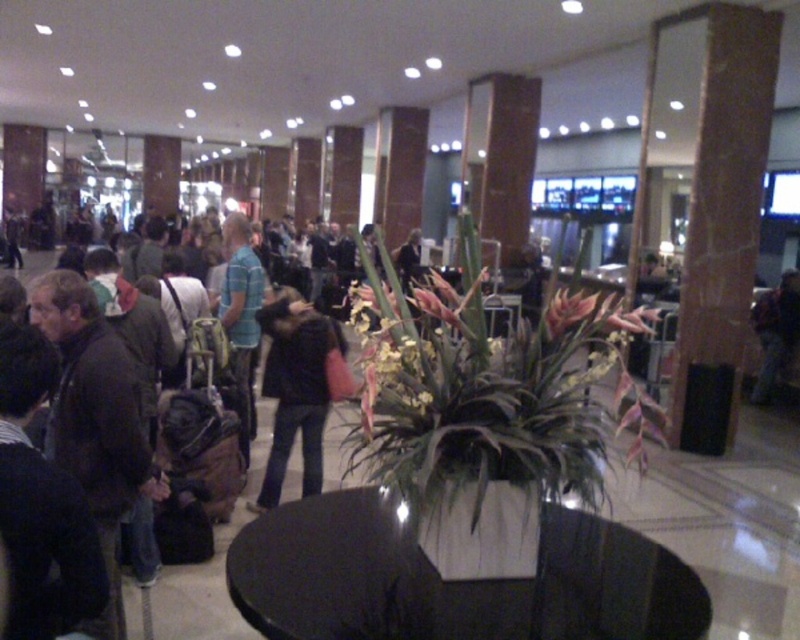
Between black leather jacket at center and dark blue jeans at center, which one has more height?

dark blue jeans at center is taller.

Where is `black leather jacket at center`? black leather jacket at center is located at coordinates (296, 388).

Where is `black leather jacket at center`? This screenshot has width=800, height=640. black leather jacket at center is located at coordinates (296, 388).

Is black glossy table at center thinner than black leather jacket at center?

In fact, black glossy table at center might be wider than black leather jacket at center.

Is black glossy table at center wider than black leather jacket at center?

Correct, the width of black glossy table at center exceeds that of black leather jacket at center.

What do you see at coordinates (452, 580) in the screenshot? Image resolution: width=800 pixels, height=640 pixels. I see `black glossy table at center` at bounding box center [452, 580].

Image resolution: width=800 pixels, height=640 pixels. I want to click on black glossy table at center, so click(x=452, y=580).

Between point (274, 465) and point (572, 312), which one is positioned in front?

Point (572, 312)

Is black leather jacket at center thinner than pink matte flower at center?

Indeed, black leather jacket at center has a lesser width compared to pink matte flower at center.

In order to click on black leather jacket at center in this screenshot , I will do `click(296, 388)`.